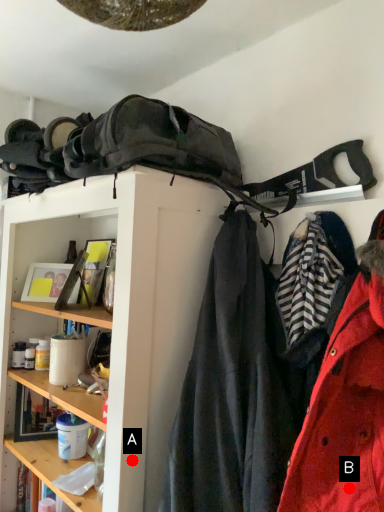
Question: Two points are circled on the image, labeled by A and B beside each circle. Among these points, which one is farthest from the camera?

Choices:
 (A) A is further
 (B) B is further

Answer: (A)